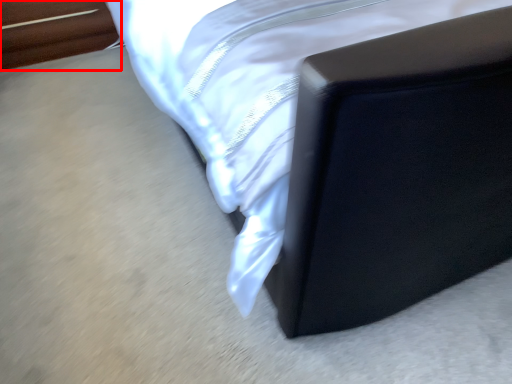
Question: From the image, what is the correct spatial relationship of furniture (annotated by the red box) in relation to furniture?

Choices:
 (A) left
 (B) right

Answer: (A)